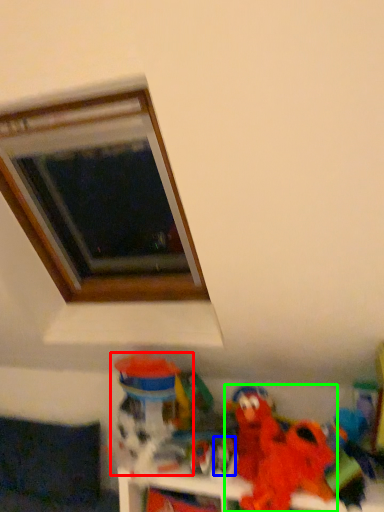
Question: Based on their relative distances, which object is nearer to toy (highlighted by a red box)? Choose from toy (highlighted by a blue box) and toy (highlighted by a green box).

Choices:
 (A) toy
 (B) toy

Answer: (A)